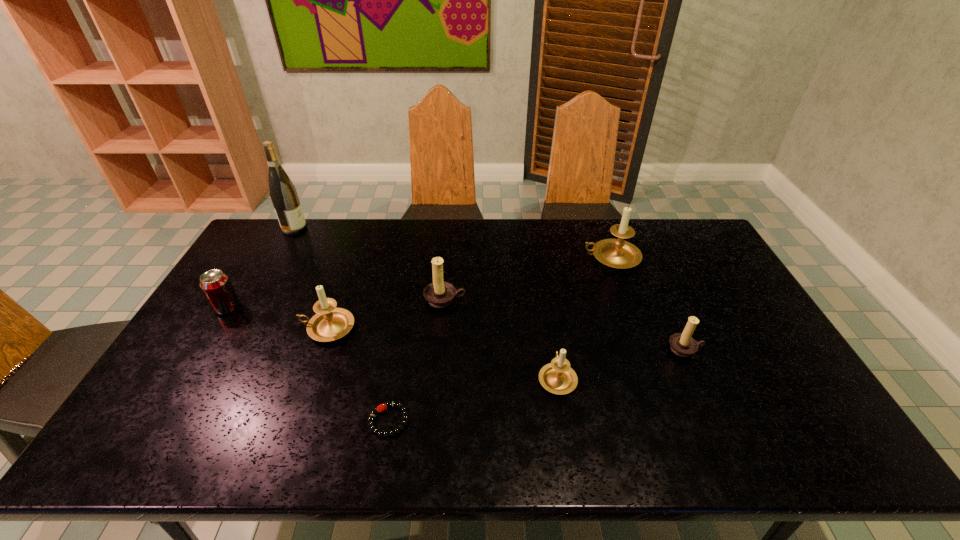
Image resolution: width=960 pixels, height=540 pixels. Find the location of `free space that is in between the third object from right to left and the bracelet`. free space that is in between the third object from right to left and the bracelet is located at coordinates (473, 399).

Find the location of a particular element. The height and width of the screenshot is (540, 960). free space between the third candle holder from left to right and the farthest beige candle holder is located at coordinates (585, 318).

Where is `vacant region between the farthest beige candle holder and the right brown candle holder`? This screenshot has width=960, height=540. vacant region between the farthest beige candle holder and the right brown candle holder is located at coordinates [x=648, y=303].

This screenshot has width=960, height=540. Find the location of `free area in between the leftmost candle holder and the soda can`. free area in between the leftmost candle holder and the soda can is located at coordinates (277, 318).

This screenshot has height=540, width=960. I want to click on unoccupied area between the nearest object and the fourth candle holder from right to left, so click(417, 360).

Where is `vacant point located between the nearer brown candle holder and the soda can`? The width and height of the screenshot is (960, 540). vacant point located between the nearer brown candle holder and the soda can is located at coordinates (456, 328).

The image size is (960, 540). In order to click on free space between the nearest object and the biggest beige candle holder in this screenshot , I will do `click(500, 339)`.

At what (x,y) coordinates should I click in order to perform the action: click on free spot between the second nearest beige candle holder and the smallest beige candle holder. Please return your answer as a coordinate pair (x, y). Looking at the image, I should click on (443, 353).

You are a GUI agent. You are given a task and a screenshot of the screen. Output one action in this format:
    pyautogui.click(x=<x>, y=<y>)
    Task: Click on the blank region between the nearer brown candle holder and the second candle holder from left to right
    Image resolution: width=960 pixels, height=540 pixels.
    Given the screenshot: What is the action you would take?
    pyautogui.click(x=565, y=324)

The width and height of the screenshot is (960, 540). I want to click on free spot between the right brown candle holder and the wine bottle, so click(490, 288).